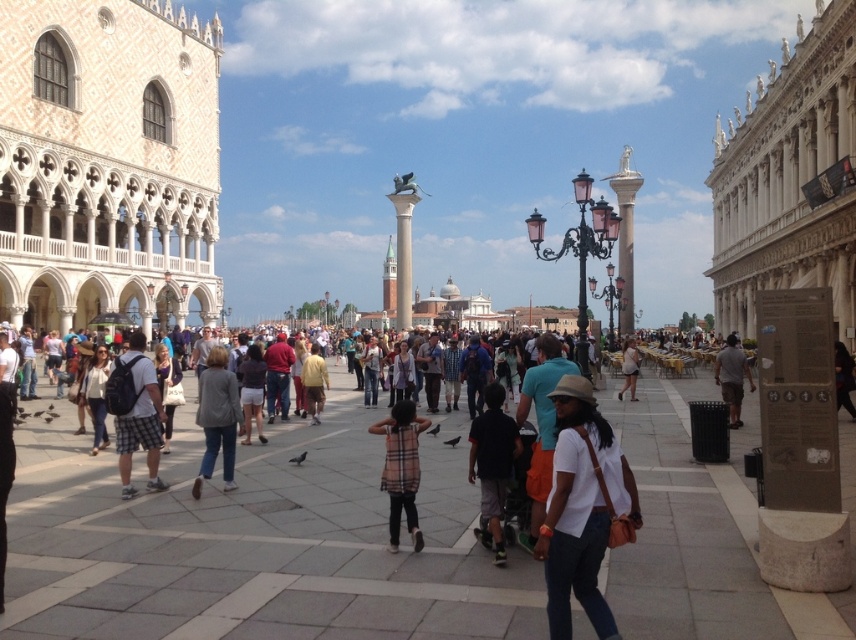
Question: Based on their relative distances, which object is farther from the plaid fabric dress at center?

Choices:
 (A) matte black backpack at center
 (B) light brown leather jacket at center

Answer: (B)

Question: Does matte gray pavement at center appear under matte black backpack at center?

Choices:
 (A) no
 (B) yes

Answer: (B)

Question: Can you confirm if white mosaic building at left is bigger than light brown leather jacket at center?

Choices:
 (A) no
 (B) yes

Answer: (B)

Question: Which object is closer to the camera taking this photo?

Choices:
 (A) white mosaic building at left
 (B) white matte shirt at center
 (C) white marble palace at right
 (D) plaid fabric dress at center

Answer: (B)

Question: Can you confirm if white mosaic building at left is thinner than white marble palace at right?

Choices:
 (A) no
 (B) yes

Answer: (B)

Question: Among these points, which one is nearest to the camera?

Choices:
 (A) (468, 481)
 (B) (626, 355)
 (C) (418, 464)
 (D) (183, 161)

Answer: (C)